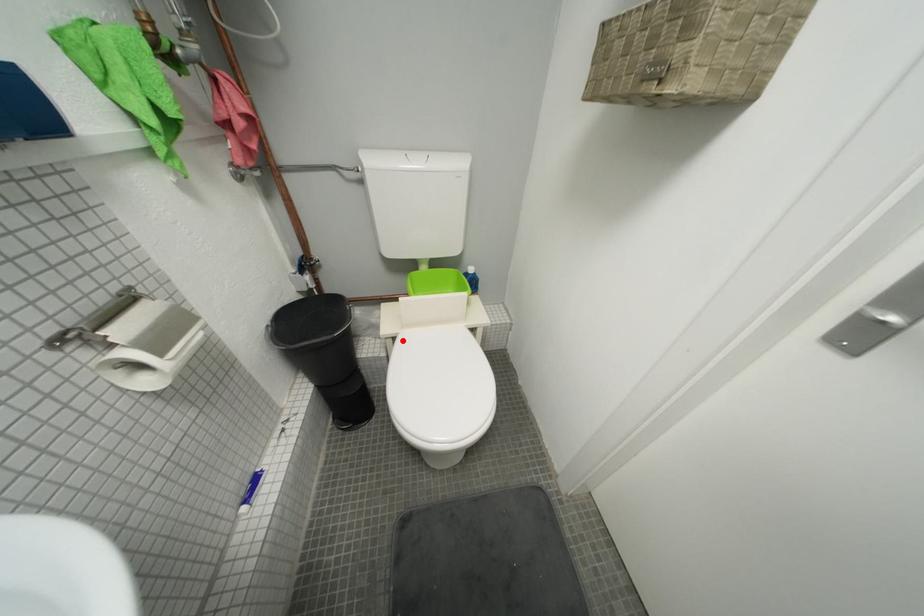
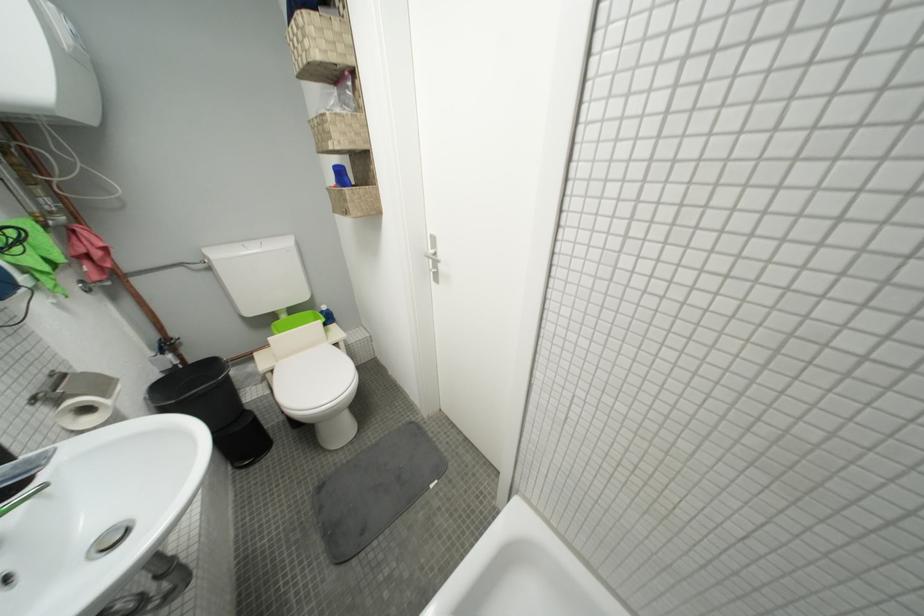
In the second image, find the point that corresponds to the highlighted location in the first image.

(281, 373)